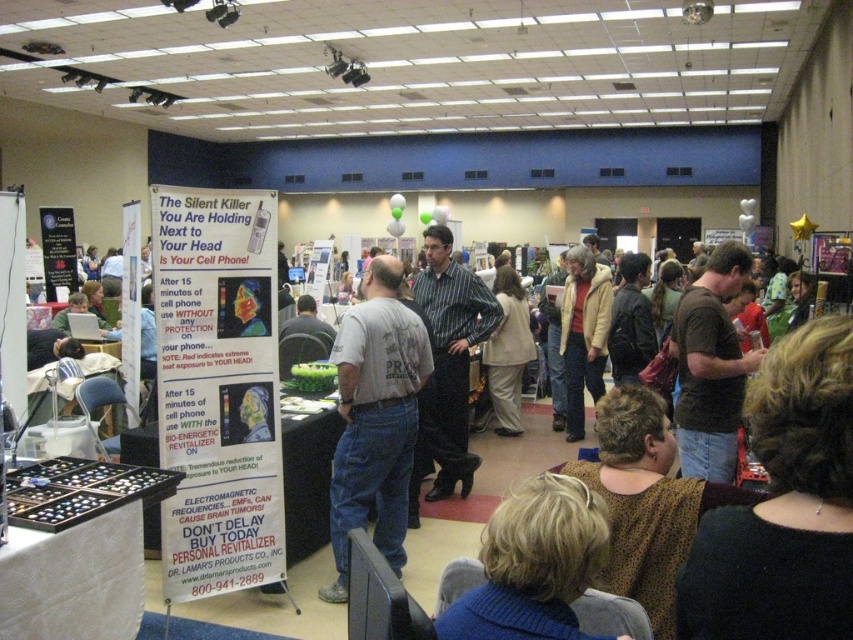
You are standing in the convention hall and notice the white signboard in front of you. Where is the striped cotton shirt at center relative to the signboard?

The striped cotton shirt at center is located at point [447,365] relative to the signboard.